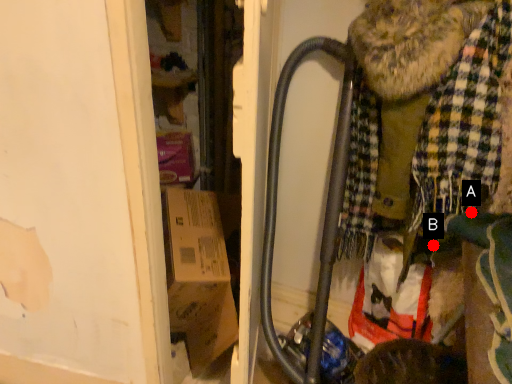
Question: Two points are circled on the image, labeled by A and B beside each circle. Which point appears closest to the camera in this image?

Choices:
 (A) A is closer
 (B) B is closer

Answer: (A)